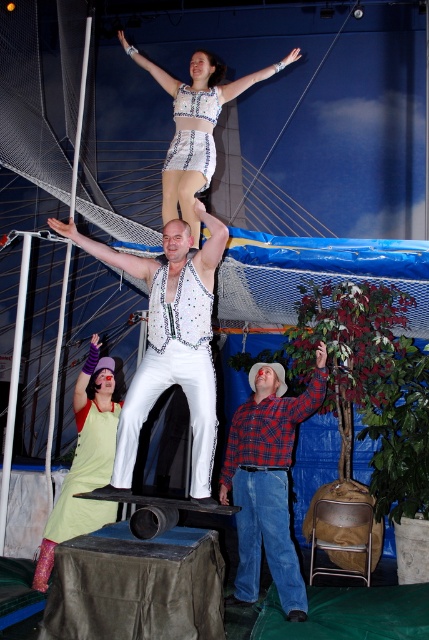
Does white sequined dress at upper center appear under matte silver arm at upper center?

Correct, white sequined dress at upper center is located below matte silver arm at upper center.

Locate an element on the screen. white sequined dress at upper center is located at coordinates (181, 196).

Describe the element at coordinates (181, 196) in the screenshot. I see `white sequined dress at upper center` at that location.

Locate an element on the screen. The width and height of the screenshot is (429, 640). white sequined dress at upper center is located at coordinates (181, 196).

Does white sequined vest at center appear on the left side of light green fabric dress at center?

Incorrect, white sequined vest at center is not on the left side of light green fabric dress at center.

In the scene shown: Does white sequined vest at center lie behind light green fabric dress at center?

No, white sequined vest at center is closer to the viewer.

The height and width of the screenshot is (640, 429). I want to click on white sequined vest at center, so click(169, 340).

Does light green fabric dress at center have a smaller size compared to shiny silver dress at upper center?

No.

Is point (84, 413) in front of point (269, 67)?

That is True.

Locate an element on the screen. The width and height of the screenshot is (429, 640). light green fabric dress at center is located at coordinates (84, 461).